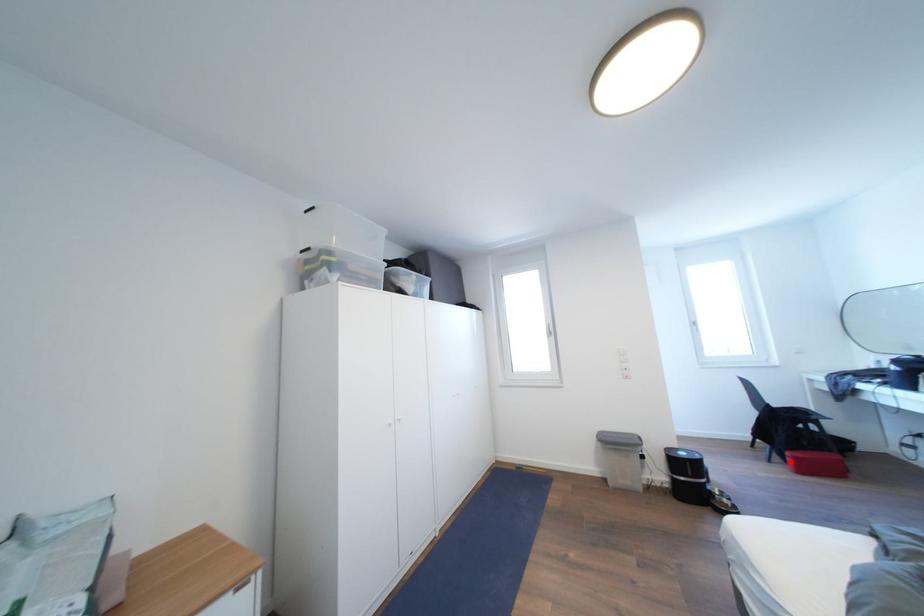
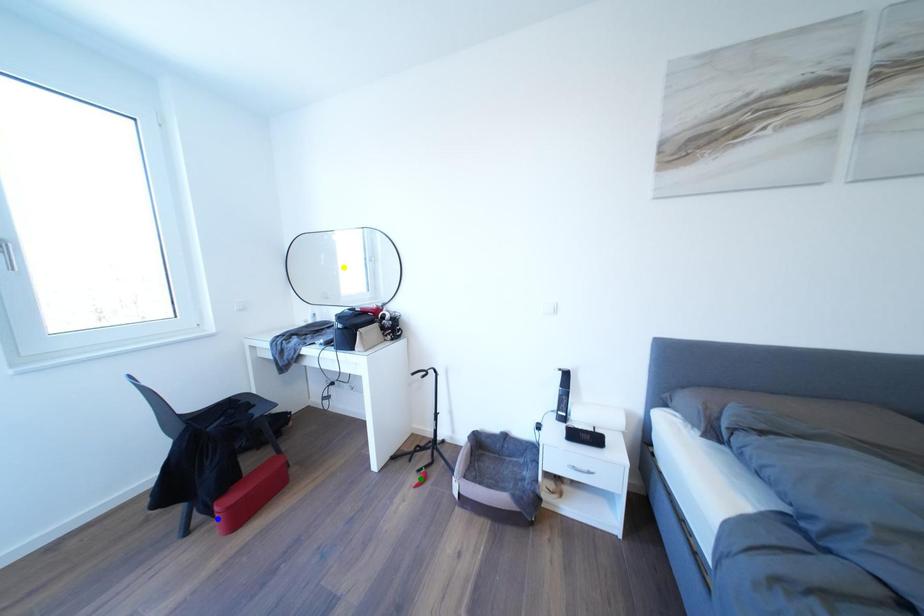
Question: I am providing you with two images of the same scene from different viewpoints. A red point is marked on the first image. You are given multiple points on the second image. Can you choose the point in image 2 that corresponds to the point in image 1?

Choices:
 (A) blue point
 (B) green point
 (C) yellow point

Answer: (A)